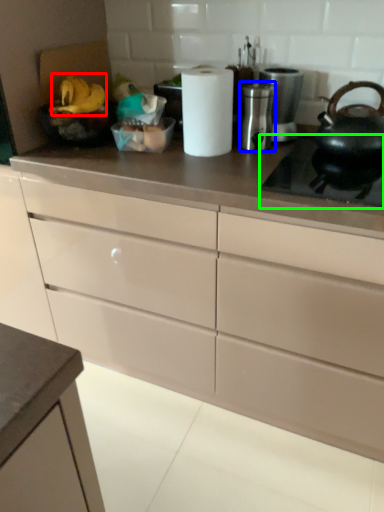
Question: Which object is positioned closest to food (highlighted by a red box)? Select from appliance (highlighted by a blue box) and gas stove (highlighted by a green box).

Choices:
 (A) appliance
 (B) gas stove

Answer: (A)